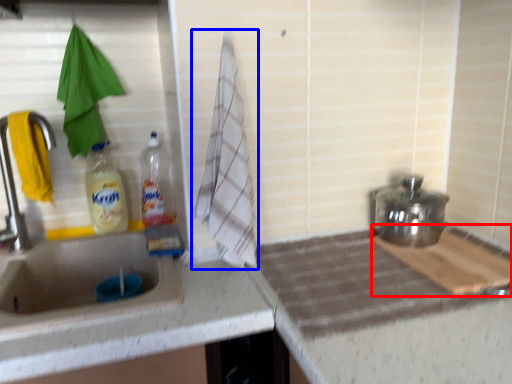
Question: Which point is closer to the camera, cutting board (highlighted by a red box) or beach towel (highlighted by a blue box)?

Choices:
 (A) cutting board
 (B) beach towel

Answer: (A)